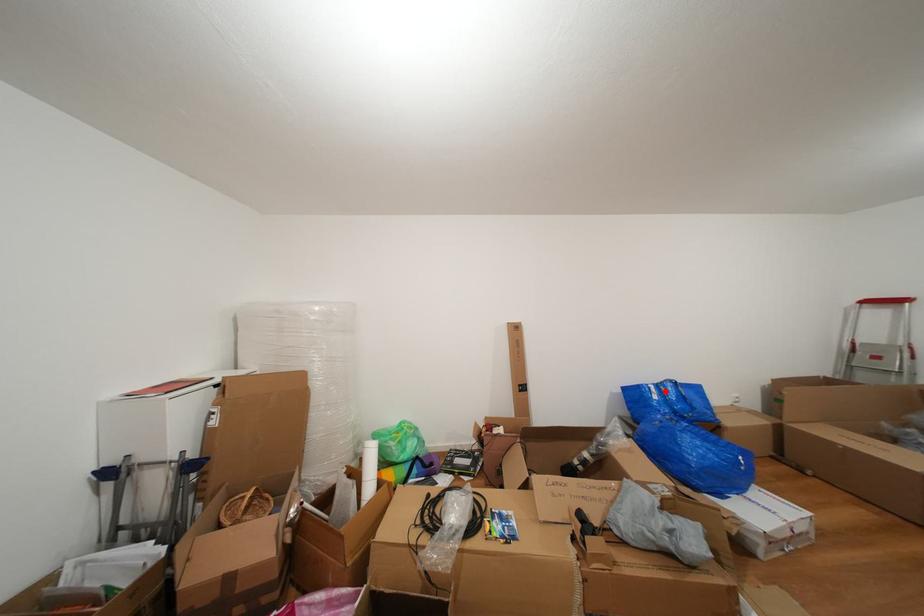
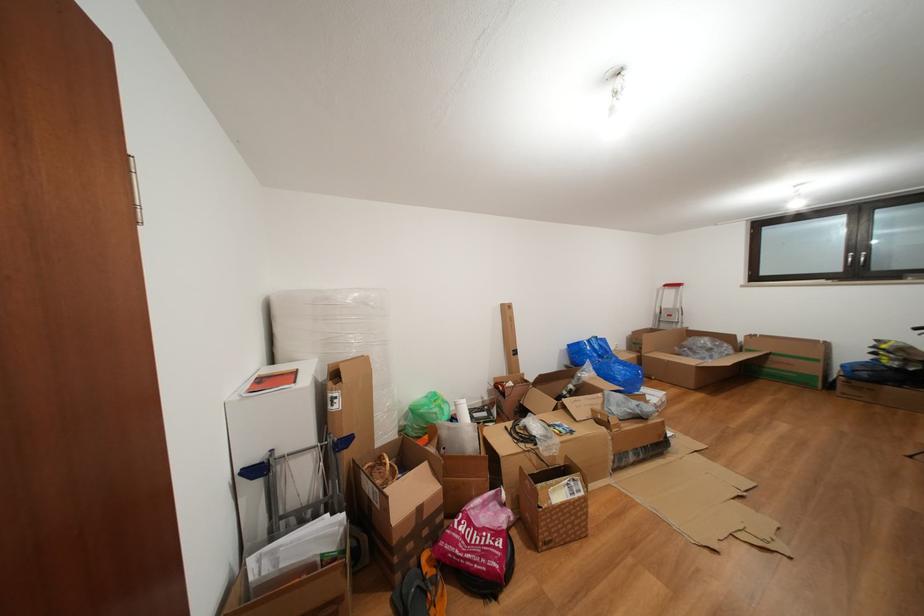
Where in the second image is the point corresponding to the highlighted location from the first image?

(597, 346)